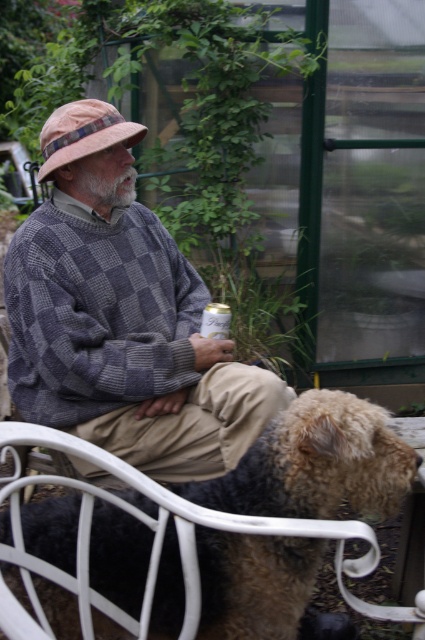
Who is taller, fuzzy brown fur at lower center or metallic can at center?

Standing taller between the two is fuzzy brown fur at lower center.

Based on the photo, measure the distance from fuzzy brown fur at lower center to metallic can at center.

The distance of fuzzy brown fur at lower center from metallic can at center is 38.01 inches.

Which is behind, point (104, 582) or point (215, 304)?

Positioned behind is point (215, 304).

At what (x,y) coordinates should I click in order to perform the action: click on fuzzy brown fur at lower center. Please return your answer as a coordinate pair (x, y). Looking at the image, I should click on (314, 464).

Does checkered wool sweater at center appear on the left side of fuzzy brown fur at lower center?

Yes, checkered wool sweater at center is to the left of fuzzy brown fur at lower center.

Looking at this image, who is more forward, (84, 264) or (54, 609)?

Point (54, 609)

This screenshot has width=425, height=640. Describe the element at coordinates (121, 316) in the screenshot. I see `checkered wool sweater at center` at that location.

Locate an element on the screen. checkered wool sweater at center is located at coordinates (121, 316).

Does point (161, 413) come closer to viewer compared to point (218, 305)?

Yes, point (161, 413) is in front of point (218, 305).

Does point (153, 260) come farther from viewer compared to point (204, 333)?

Yes.

Image resolution: width=425 pixels, height=640 pixels. I want to click on checkered wool sweater at center, so coord(121,316).